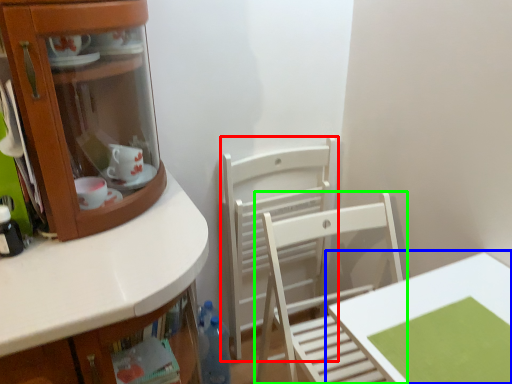
Question: Estimate the real-world distances between objects in this image. Which object is farther from chair (highlighted by a red box), table (highlighted by a blue box) or chair (highlighted by a green box)?

Choices:
 (A) table
 (B) chair

Answer: (A)